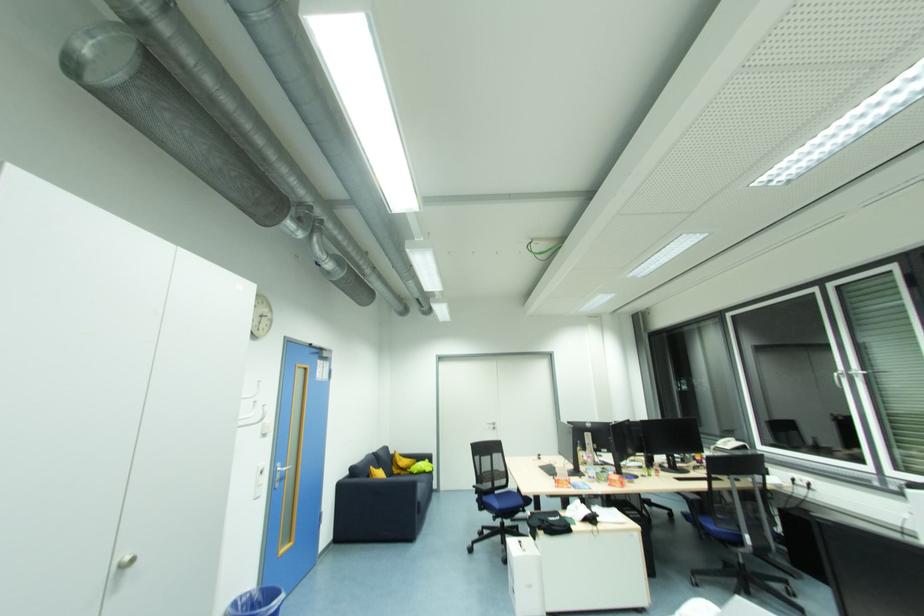
Describe the element at coordinates (485, 448) in the screenshot. I see `the chair back top rail` at that location.